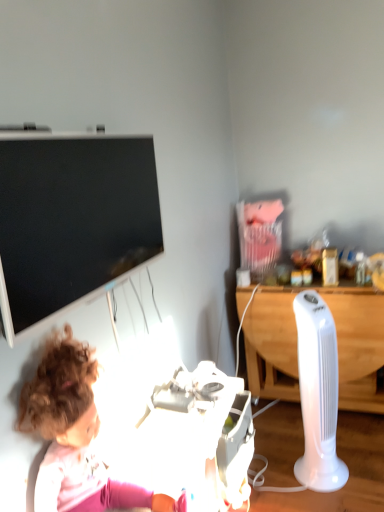
Question: Is white plastic fan at right, the second equipment viewed from the left, positioned far away from black glossy television at upper left?

Choices:
 (A) no
 (B) yes

Answer: (B)

Question: Can you confirm if white plastic fan at right, acting as the first equipment starting from the right, is taller than black glossy television at upper left?

Choices:
 (A) yes
 (B) no

Answer: (A)

Question: From a real-world perspective, is white plastic fan at right, the second equipment viewed from the left, physically below black glossy television at upper left?

Choices:
 (A) yes
 (B) no

Answer: (A)

Question: Is white plastic fan at right, the second equipment viewed from the left, behind black glossy television at upper left?

Choices:
 (A) no
 (B) yes

Answer: (B)

Question: Could you tell me if white plastic fan at right, the second equipment viewed from the left, is facing black glossy television at upper left?

Choices:
 (A) yes
 (B) no

Answer: (B)

Question: Does point (67, 502) appear closer or farther from the camera than point (203, 454)?

Choices:
 (A) farther
 (B) closer

Answer: (B)

Question: Which is correct: curly-haired doll at lower left is inside white plastic toy at lower center, the second equipment from the right, or outside of it?

Choices:
 (A) outside
 (B) inside

Answer: (A)

Question: Considering the positions of curly-haired doll at lower left and white plastic toy at lower center, the second equipment from the right, in the image, is curly-haired doll at lower left taller or shorter than white plastic toy at lower center, the second equipment from the right,?

Choices:
 (A) tall
 (B) short

Answer: (B)

Question: Considering the positions of curly-haired doll at lower left and white plastic toy at lower center, which is counted as the first equipment, starting from the left, in the image, is curly-haired doll at lower left wider or thinner than white plastic toy at lower center, which is counted as the first equipment, starting from the left,?

Choices:
 (A) thin
 (B) wide

Answer: (B)

Question: Considering the positions of white plastic fan at right, the second equipment viewed from the left, and white plastic toy at lower center, which is counted as the first equipment, starting from the left, in the image, is white plastic fan at right, the second equipment viewed from the left, wider or thinner than white plastic toy at lower center, which is counted as the first equipment, starting from the left,?

Choices:
 (A) wide
 (B) thin

Answer: (B)

Question: Considering the positions of point (301, 311) and point (213, 445), is point (301, 311) closer or farther from the camera than point (213, 445)?

Choices:
 (A) closer
 (B) farther

Answer: (B)

Question: Based on their positions, is white plastic fan at right, acting as the first equipment starting from the right, located to the left or right of white plastic toy at lower center, the second equipment from the right?

Choices:
 (A) right
 (B) left

Answer: (A)

Question: Looking at the image, does white plastic fan at right, the second equipment viewed from the left, seem bigger or smaller compared to white plastic toy at lower center, the second equipment from the right?

Choices:
 (A) big
 (B) small

Answer: (B)

Question: In terms of height, does white plastic toy at lower center, which is counted as the first equipment, starting from the left, look taller or shorter compared to black glossy television at upper left?

Choices:
 (A) tall
 (B) short

Answer: (A)

Question: Relative to black glossy television at upper left, is white plastic toy at lower center, the second equipment from the right, in front or behind?

Choices:
 (A) front
 (B) behind

Answer: (B)